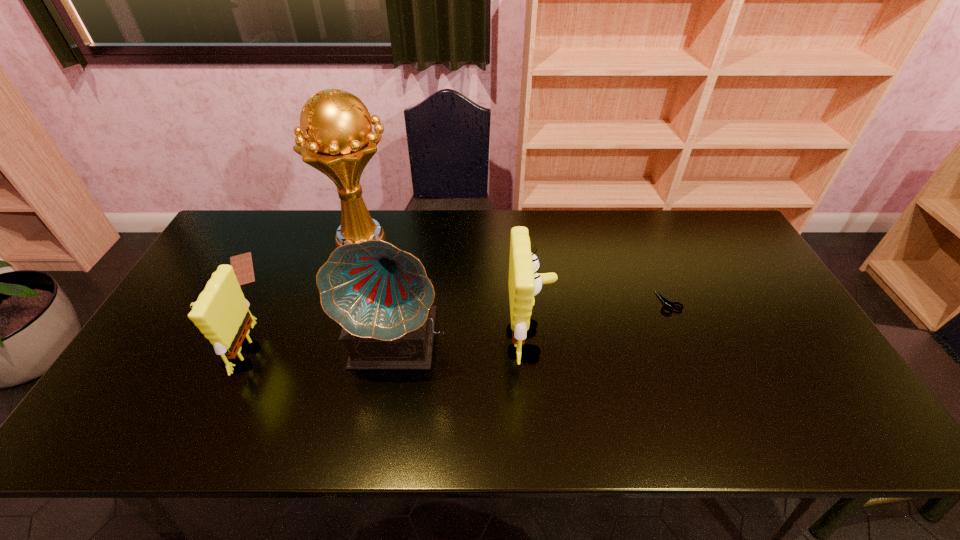
Locate an element on the screen. This screenshot has height=540, width=960. free space between the shortest object and the trophy_cup is located at coordinates (302, 254).

I want to click on the fifth closest object to the third shortest object, so click(666, 302).

Locate which object is the third closest to the fifth tallest object. Please provide its 2D coordinates. Your answer should be formatted as a tuple, i.e. [(x, y)], where the tuple contains the x and y coordinates of a point satisfying the conditions above.

[(335, 136)]

The width and height of the screenshot is (960, 540). What are the coordinates of `free space that satisfies the following two spatial constraints: 1. on the front side of the rightmost object; 2. on the face of the shorter sponge` in the screenshot? It's located at (691, 355).

Identify the location of free space in the image that satisfies the following two spatial constraints: 1. on the horn of the record player; 2. on the face of the left sponge. The height and width of the screenshot is (540, 960). (397, 355).

I want to click on free space that satisfies the following two spatial constraints: 1. at the front of the tallest object where the globe is prominent; 2. on the back side of the fifth tallest object, so coord(344,302).